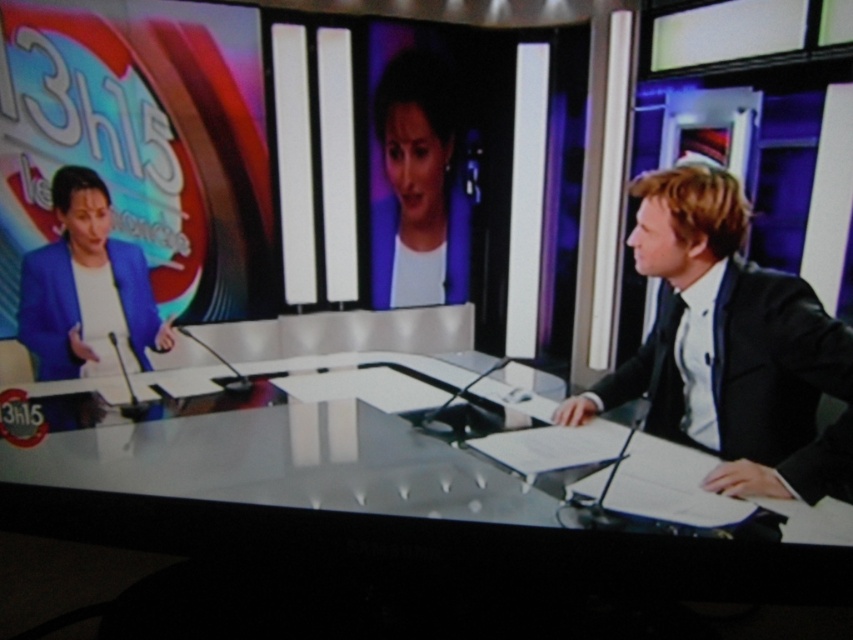
Question: Which object is closer to the camera taking this photo?

Choices:
 (A) matte blue suit at left
 (B) black glossy suit at right

Answer: (B)

Question: Can you confirm if white glossy table at center is smaller than black glossy suit at right?

Choices:
 (A) no
 (B) yes

Answer: (A)

Question: Which object is the farthest from the white glossy table at center?

Choices:
 (A) black glossy suit at right
 (B) matte white shirt at center

Answer: (B)

Question: Estimate the real-world distances between objects in this image. Which object is closer to the matte white shirt at center?

Choices:
 (A) black glossy suit at right
 (B) matte blue suit at left

Answer: (A)

Question: Is matte white shirt at center to the right of matte blue suit at left from the viewer's perspective?

Choices:
 (A) no
 (B) yes

Answer: (B)

Question: Can you confirm if white glossy table at center is smaller than matte white shirt at center?

Choices:
 (A) no
 (B) yes

Answer: (A)